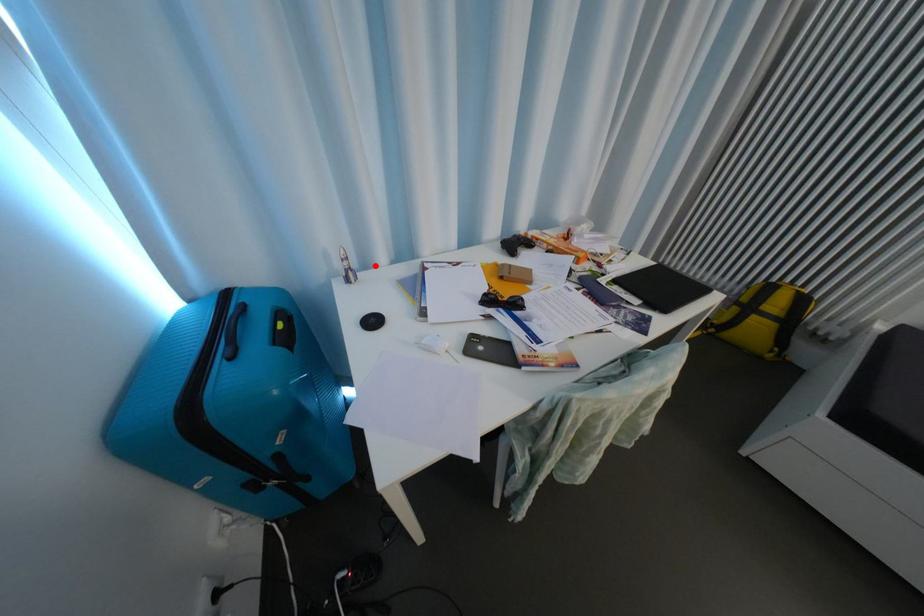
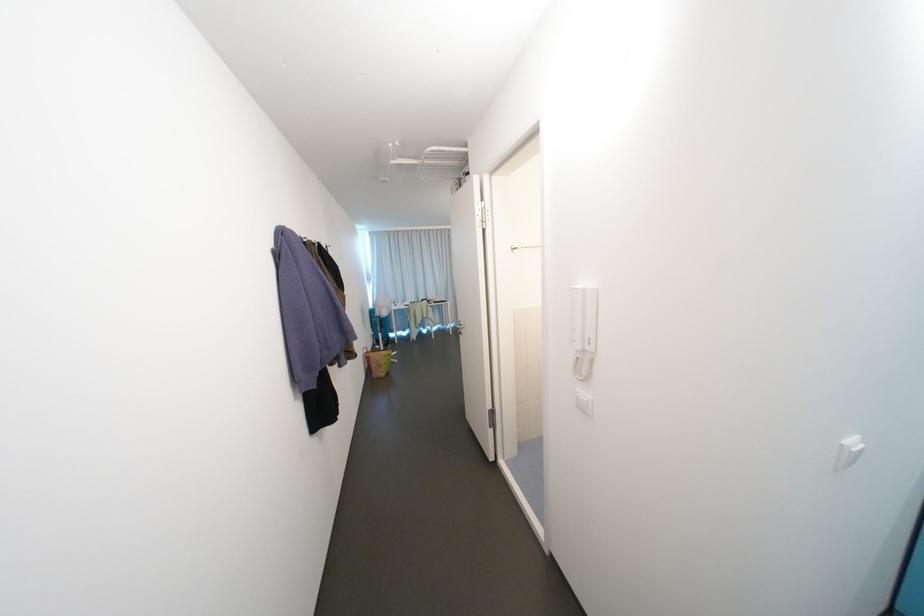
The point at the highlighted location is marked in the first image. Where is the corresponding point in the second image?

(406, 304)